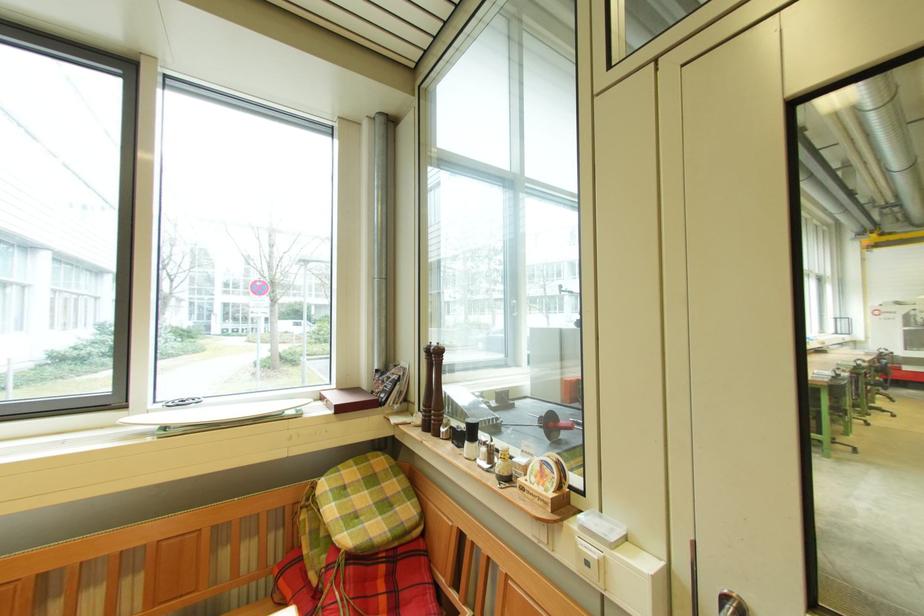
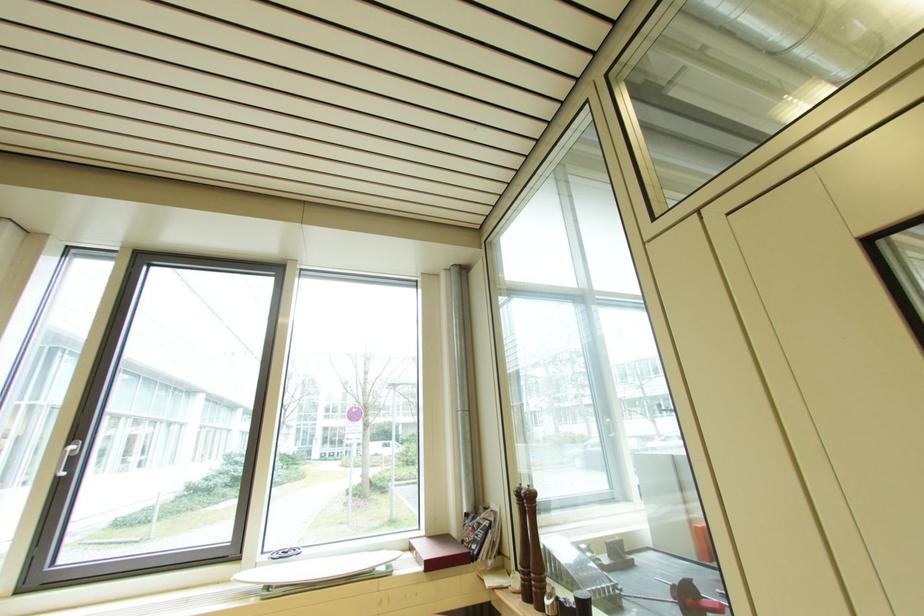
In the second image, find the point that corresponds to pixel 331 395 in the first image.

(420, 545)